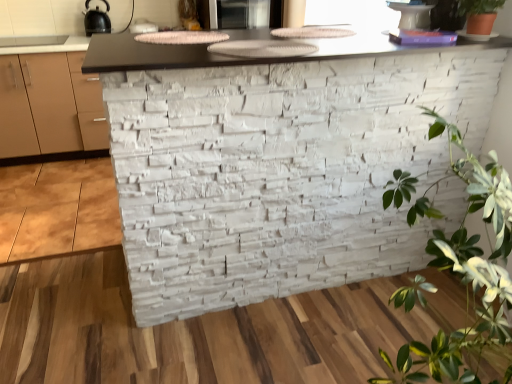
Question: Considering the relative sizes of green matte plant at upper right, marked as the first houseplant in a top-to-bottom arrangement, and black matte kettle at upper left, the second appliance from the right, in the image provided, is green matte plant at upper right, marked as the first houseplant in a top-to-bottom arrangement, bigger than black matte kettle at upper left, the second appliance from the right,?

Choices:
 (A) no
 (B) yes

Answer: (A)

Question: From a real-world perspective, is green matte plant at upper right, marked as the first houseplant in a top-to-bottom arrangement, physically above black matte kettle at upper left, the 1th appliance viewed from the left?

Choices:
 (A) no
 (B) yes

Answer: (B)

Question: Is there a large distance between green matte plant at upper right, positioned as the second houseplant in bottom-to-top order, and black matte kettle at upper left, the 1th appliance viewed from the left?

Choices:
 (A) no
 (B) yes

Answer: (B)

Question: Is the depth of green matte plant at upper right, marked as the first houseplant in a top-to-bottom arrangement, greater than that of black matte kettle at upper left, the 1th appliance viewed from the left?

Choices:
 (A) no
 (B) yes

Answer: (A)

Question: Is green matte plant at upper right, positioned as the second houseplant in bottom-to-top order, placed right next to black matte kettle at upper left, the second appliance from the right?

Choices:
 (A) yes
 (B) no

Answer: (B)

Question: Considering the relative positions of green matte plant at upper right, marked as the first houseplant in a top-to-bottom arrangement, and black matte kettle at upper left, the 1th appliance viewed from the left, in the image provided, is green matte plant at upper right, marked as the first houseplant in a top-to-bottom arrangement, to the right of black matte kettle at upper left, the 1th appliance viewed from the left, from the viewer's perspective?

Choices:
 (A) yes
 (B) no

Answer: (A)

Question: Is white stone wall at center positioned beyond the bounds of green leafy plant at right, which is counted as the 1th houseplant, starting from the bottom?

Choices:
 (A) no
 (B) yes

Answer: (B)

Question: Does white stone wall at center appear on the left side of green leafy plant at right, which ranks as the second houseplant in top-to-bottom order?

Choices:
 (A) yes
 (B) no

Answer: (A)

Question: Considering the relative sizes of white stone wall at center and green leafy plant at right, which is counted as the 1th houseplant, starting from the bottom, in the image provided, is white stone wall at center wider than green leafy plant at right, which is counted as the 1th houseplant, starting from the bottom,?

Choices:
 (A) yes
 (B) no

Answer: (A)

Question: Considering the relative sizes of white stone wall at center and green leafy plant at right, which is counted as the 1th houseplant, starting from the bottom, in the image provided, is white stone wall at center taller than green leafy plant at right, which is counted as the 1th houseplant, starting from the bottom,?

Choices:
 (A) yes
 (B) no

Answer: (A)

Question: Does white stone wall at center come in front of green leafy plant at right, which is counted as the 1th houseplant, starting from the bottom?

Choices:
 (A) no
 (B) yes

Answer: (A)

Question: Does white stone wall at center have a lesser width compared to green leafy plant at right, which is counted as the 1th houseplant, starting from the bottom?

Choices:
 (A) no
 (B) yes

Answer: (A)

Question: From a real-world perspective, is black matte kettle at upper left, the second appliance from the right, physically below white stone wall at center?

Choices:
 (A) no
 (B) yes

Answer: (A)